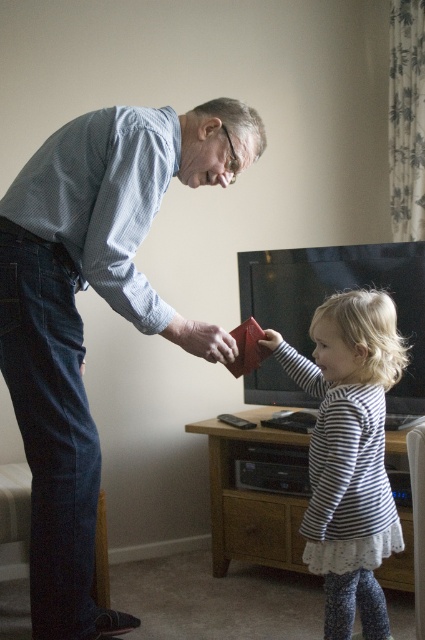
You are a security camera in the living room. You need to determine whether the matte blue shirt at upper left is to the left or right of the matte red wallet at center. Based on the scene, which side is it on?

The matte blue shirt at upper left is positioned on the left side of the matte red wallet at center.

You are a photographer setting up a shoot in this living room. You need to place a small prop between the striped fabric dress at center and the matte red wallet at center. Based on their sizes, which object should the prop be placed closer to?

The striped fabric dress at center is bigger than the matte red wallet at center, so the prop should be placed closer to the matte red wallet at center to balance the visual weight.

From the picture: You are a robot in the living room and need to move from the older man to the child. The older man is at point (195, 131) and the child is at point (274, 346). Which direction should you move to go from the older man to the child?

To move from the older man at point (195, 131) to the child at point (274, 346), you should move forward since point (195, 131) is in front of point (274, 346).